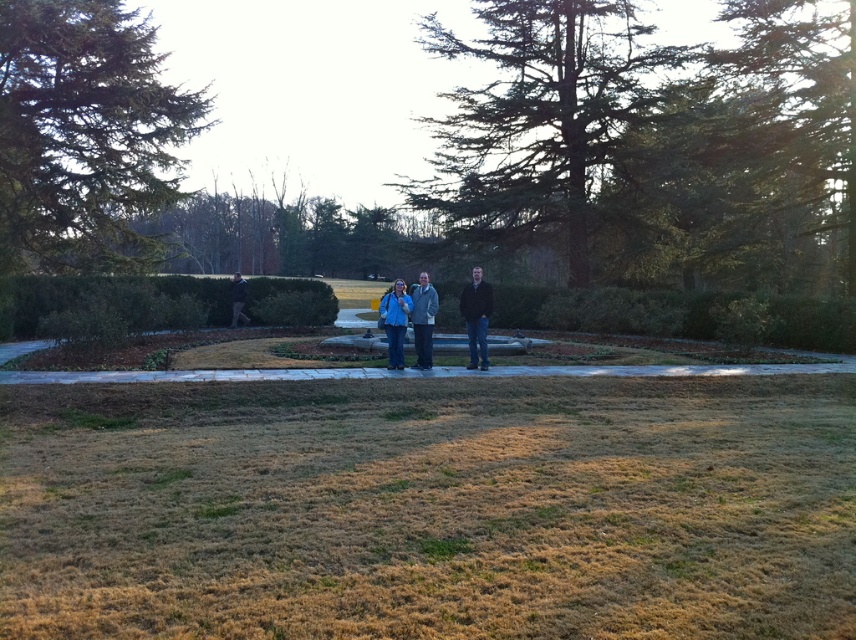
You are standing at the entrance of the park and see the green textured tree at upper left and the blue fabric jacket at center. Which object is positioned more to the left side of the scene?

The green textured tree at upper left is positioned more to the left side of the scene than the blue fabric jacket at center.